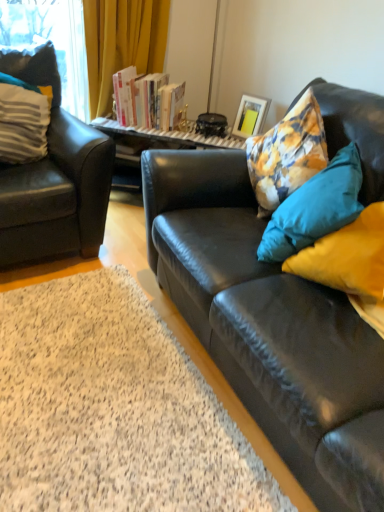
Question: Should I look upward or downward to see floral fabric cushion at right, acting as the 2th pillow starting from the left?

Choices:
 (A) down
 (B) up

Answer: (B)

Question: Would you say matte black armchair at left is part of hardcover books at center's contents?

Choices:
 (A) no
 (B) yes

Answer: (A)

Question: Can you confirm if hardcover books at center is thinner than matte black armchair at left?

Choices:
 (A) yes
 (B) no

Answer: (A)

Question: Is hardcover books at center positioned in front of matte black armchair at left?

Choices:
 (A) yes
 (B) no

Answer: (B)

Question: Is hardcover books at center to the right of matte black armchair at left from the viewer's perspective?

Choices:
 (A) no
 (B) yes

Answer: (B)

Question: Can you confirm if hardcover books at center is positioned to the left of matte black armchair at left?

Choices:
 (A) no
 (B) yes

Answer: (A)

Question: From a real-world perspective, is hardcover books at center on matte black armchair at left?

Choices:
 (A) yes
 (B) no

Answer: (A)

Question: From the image's perspective, does white striped pillow at left, acting as the first pillow starting from the left, appear lower than floral fabric cushion at right, which ranks as the first pillow in right-to-left order?

Choices:
 (A) no
 (B) yes

Answer: (A)

Question: Is floral fabric cushion at right, which ranks as the first pillow in right-to-left order, at the back of white striped pillow at left, which is counted as the 2th pillow, starting from the right?

Choices:
 (A) yes
 (B) no

Answer: (B)

Question: Considering the relative positions of white striped pillow at left, which is counted as the 2th pillow, starting from the right, and floral fabric cushion at right, which ranks as the first pillow in right-to-left order, in the image provided, is white striped pillow at left, which is counted as the 2th pillow, starting from the right, in front of floral fabric cushion at right, which ranks as the first pillow in right-to-left order,?

Choices:
 (A) yes
 (B) no

Answer: (B)

Question: Does white striped pillow at left, which is counted as the 2th pillow, starting from the right, have a larger size compared to floral fabric cushion at right, acting as the 2th pillow starting from the left?

Choices:
 (A) no
 (B) yes

Answer: (A)

Question: Is white striped pillow at left, acting as the first pillow starting from the left, to the left of floral fabric cushion at right, which ranks as the first pillow in right-to-left order, from the viewer's perspective?

Choices:
 (A) no
 (B) yes

Answer: (B)

Question: From the image's perspective, does white striped pillow at left, acting as the first pillow starting from the left, appear higher than floral fabric cushion at right, acting as the 2th pillow starting from the left?

Choices:
 (A) no
 (B) yes

Answer: (B)

Question: Considering the relative sizes of matte black armchair at left and black leather couch at right in the image provided, is matte black armchair at left bigger than black leather couch at right?

Choices:
 (A) yes
 (B) no

Answer: (A)